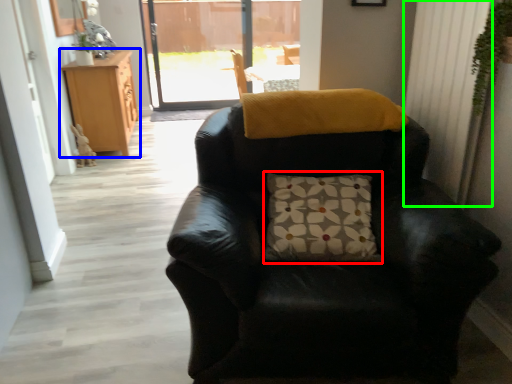
Question: Based on their relative distances, which object is farther from pillow (highlighted by a red box)? Choose from cabinetry (highlighted by a blue box) and curtain (highlighted by a green box).

Choices:
 (A) cabinetry
 (B) curtain

Answer: (A)